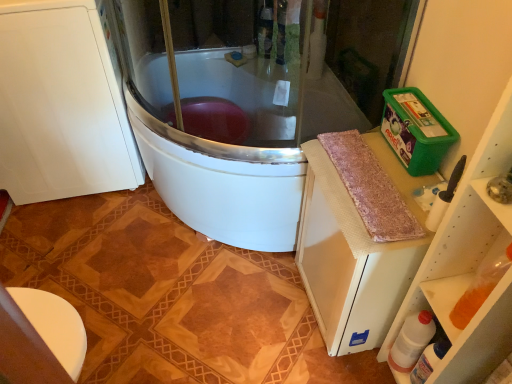
Identify the location of white plastic bottle at lower right, the 1th bottle when ordered from left to right. (411, 341).

What is the approximate height of green plastic container at upper right?

It is 83.09 centimeters.

What is the approximate width of white glossy bathtub at center?

white glossy bathtub at center is 39.31 inches wide.

Image resolution: width=512 pixels, height=384 pixels. What do you see at coordinates (220, 151) in the screenshot?
I see `white glossy bathtub at center` at bounding box center [220, 151].

Measure the distance between white matte cabinet at left and camera.

white matte cabinet at left is 4.25 feet away from camera.

Locate an element on the screen. The width and height of the screenshot is (512, 384). white matte cabinet at left is located at coordinates (61, 104).

What are the coordinates of `white plastic bottle at lower right, which is the 2th bottle in right-to-left order` in the screenshot? It's located at (411, 341).

Can you confirm if white plastic bottle at lower right, placed as the 2th bottle when sorted from left to right, is smaller than green plastic container at upper right?

Yes, white plastic bottle at lower right, placed as the 2th bottle when sorted from left to right, is smaller than green plastic container at upper right.

Does white plastic bottle at lower right, placed as the 2th bottle when sorted from left to right, have a lesser width compared to green plastic container at upper right?

Yes.

Considering the positions of objects white plastic bottle at lower right, the first bottle positioned from the right, and green plastic container at upper right in the image provided, who is in front, white plastic bottle at lower right, the first bottle positioned from the right, or green plastic container at upper right?

Positioned in front is green plastic container at upper right.

Locate an element on the screen. This screenshot has height=384, width=512. bottle that is the 1st one when counting backward from the green plastic container at upper right is located at coordinates (429, 360).

Which object is wider, white plastic bottle at lower right, which is the 2th bottle in right-to-left order, or black plastic brush at right, the 1th appliance in the front-to-back sequence?

Wider between the two is white plastic bottle at lower right, which is the 2th bottle in right-to-left order.

Can you tell me how much white plastic bottle at lower right, the 1th bottle when ordered from left to right, and black plastic brush at right, acting as the 2th appliance starting from the top, differ in facing direction?

They differ by 1.82 degrees in their facing directions.

Between white plastic bottle at lower right, the 1th bottle when ordered from left to right, and black plastic brush at right, marked as the second appliance in a back-to-front arrangement, which one has larger size?

With larger size is white plastic bottle at lower right, the 1th bottle when ordered from left to right.

Starting from the white plastic bottle at lower right, the 1th bottle when ordered from left to right, which appliance is the 1st one to the right? Please provide its 2D coordinates.

[(445, 197)]

Considering the sizes of white matte cabinet at left and pink shaggy rug at right in the image, is white matte cabinet at left taller or shorter than pink shaggy rug at right?

white matte cabinet at left is taller than pink shaggy rug at right.

From the image's perspective, which is below, white matte cabinet at left or pink shaggy rug at right?

pink shaggy rug at right, from the image's perspective.

Does point (119, 163) come farther from viewer compared to point (347, 176)?

Yes, point (119, 163) is farther from viewer.

From the picture: Is white matte cabinet at left oriented towards pink shaggy rug at right?

No, white matte cabinet at left is not aimed at pink shaggy rug at right.

Can you confirm if green plastic container at upper right, which is the 2th appliance from front to back, is shorter than white glossy bathtub at center?

Yes, green plastic container at upper right, which is the 2th appliance from front to back, is shorter than white glossy bathtub at center.

From the image's perspective, is green plastic container at upper right, positioned as the first appliance in back-to-front order, located beneath white glossy bathtub at center?

Yes.

Considering the sizes of green plastic container at upper right, positioned as the first appliance in back-to-front order, and white glossy bathtub at center in the image, is green plastic container at upper right, positioned as the first appliance in back-to-front order, wider or thinner than white glossy bathtub at center?

green plastic container at upper right, positioned as the first appliance in back-to-front order, is thinner than white glossy bathtub at center.

From the image's perspective, which one is positioned higher, green plastic container at upper right or white matte cabinet at left?

white matte cabinet at left.

Between green plastic container at upper right and white matte cabinet at left, which one has smaller size?

green plastic container at upper right.

Is green plastic container at upper right wider than white matte cabinet at left?

No.

From a real-world perspective, which object stands above the other?

green plastic container at upper right, from a real-world perspective.

Based on the photo, from the image's perspective, is pink shaggy rug at right on green plastic container at upper right, which is the 2th appliance from front to back?

No, from the image's perspective, pink shaggy rug at right is not on top of green plastic container at upper right, which is the 2th appliance from front to back.

Considering the relative positions of pink shaggy rug at right and green plastic container at upper right, positioned as the first appliance in back-to-front order, in the image provided, is pink shaggy rug at right to the left of green plastic container at upper right, positioned as the first appliance in back-to-front order, from the viewer's perspective?

Yes, pink shaggy rug at right is to the left of green plastic container at upper right, positioned as the first appliance in back-to-front order.

Considering the positions of objects pink shaggy rug at right and green plastic container at upper right, which is the 2th appliance from front to back, in the image provided, who is in front, pink shaggy rug at right or green plastic container at upper right, which is the 2th appliance from front to back,?

pink shaggy rug at right is more forward.

In terms of width, does pink shaggy rug at right look wider or thinner when compared to green plastic container at upper right, positioned as the first appliance in back-to-front order?

In the image, pink shaggy rug at right appears to be wider than green plastic container at upper right, positioned as the first appliance in back-to-front order.

Where is `cabinetry above the pink shaggy rug at right (from the image's perspective)`? The image size is (512, 384). cabinetry above the pink shaggy rug at right (from the image's perspective) is located at coordinates (61, 104).

Does pink shaggy rug at right have a lesser height compared to white matte cabinet at left?

Yes.

Based on the photo, is the position of pink shaggy rug at right less distant than that of white matte cabinet at left?

Yes, it is in front of white matte cabinet at left.

Which point is more forward, (386, 200) or (99, 189)?

The point (386, 200) is more forward.

Locate an element on the screen. The width and height of the screenshot is (512, 384). bottle that is the 1st one when counting backward from the green plastic container at upper right is located at coordinates (429, 360).

The image size is (512, 384). Find the location of `appliance that is the 1st one when counting rightward from the white plastic bottle at lower right, which is the 2th bottle in right-to-left order`. appliance that is the 1st one when counting rightward from the white plastic bottle at lower right, which is the 2th bottle in right-to-left order is located at coordinates (445, 197).

Looking at the image, which one is located further to white matte cabinet at left, green plastic container at upper right or white glossy bathtub at center?

Among the two, green plastic container at upper right is located further to white matte cabinet at left.

From the image, which object appears to be farther from white plastic bottle at lower right, placed as the 2th bottle when sorted from left to right, white plastic bottle at lower right, the 1th bottle when ordered from left to right, or white glossy bathtub at center?

white glossy bathtub at center is positioned further to the anchor white plastic bottle at lower right, placed as the 2th bottle when sorted from left to right.

Looking at the image, which one is located further to green plastic container at upper right, pink shaggy rug at right or white plastic bottle at lower right, the 1th bottle when ordered from left to right?

pink shaggy rug at right.

When comparing their distances from black plastic brush at right, marked as the second appliance in a back-to-front arrangement, does white matte cabinet at left or green plastic container at upper right, positioned as the first appliance in back-to-front order, seem closer?

green plastic container at upper right, positioned as the first appliance in back-to-front order.

From the image, which object appears to be nearer to black plastic brush at right, the 1th appliance in the front-to-back sequence, pink shaggy rug at right or white plastic bottle at lower right, the 1th bottle when ordered from left to right?

pink shaggy rug at right is closer to black plastic brush at right, the 1th appliance in the front-to-back sequence.

Estimate the real-world distances between objects in this image. Which object is further from green plastic container at upper right, white plastic bottle at lower right, the first bottle positioned from the right, or black plastic brush at right, the 1th appliance in the front-to-back sequence?

white plastic bottle at lower right, the first bottle positioned from the right, is positioned further to the anchor green plastic container at upper right.

Which object lies nearer to the anchor point green plastic container at upper right, which is the 2th appliance from front to back, green plastic container at upper right or pink shaggy rug at right?

Based on the image, pink shaggy rug at right appears to be nearer to green plastic container at upper right, which is the 2th appliance from front to back.

Considering their positions, is green plastic container at upper right positioned closer to white plastic bottle at lower right, placed as the 2th bottle when sorted from left to right, than black plastic brush at right, marked as the second appliance in a back-to-front arrangement?

green plastic container at upper right is positioned closer to the anchor white plastic bottle at lower right, placed as the 2th bottle when sorted from left to right.

I want to click on material between white matte cabinet at left and white plastic bottle at lower right, which is the 2th bottle in right-to-left order, from left to right, so click(x=370, y=188).

Where is `material located between white matte cabinet at left and black plastic brush at right, acting as the 2th appliance starting from the top, in the left-right direction`? The width and height of the screenshot is (512, 384). material located between white matte cabinet at left and black plastic brush at right, acting as the 2th appliance starting from the top, in the left-right direction is located at coordinates (370, 188).

This screenshot has height=384, width=512. In order to click on bathtub located between white matte cabinet at left and black plastic brush at right, marked as the second appliance in a back-to-front arrangement, in the left-right direction in this screenshot , I will do `click(220, 151)`.

Identify the location of shelf between white glossy bathtub at center and white plastic bottle at lower right, placed as the 2th bottle when sorted from left to right, in the vertical direction. Image resolution: width=512 pixels, height=384 pixels. (469, 262).